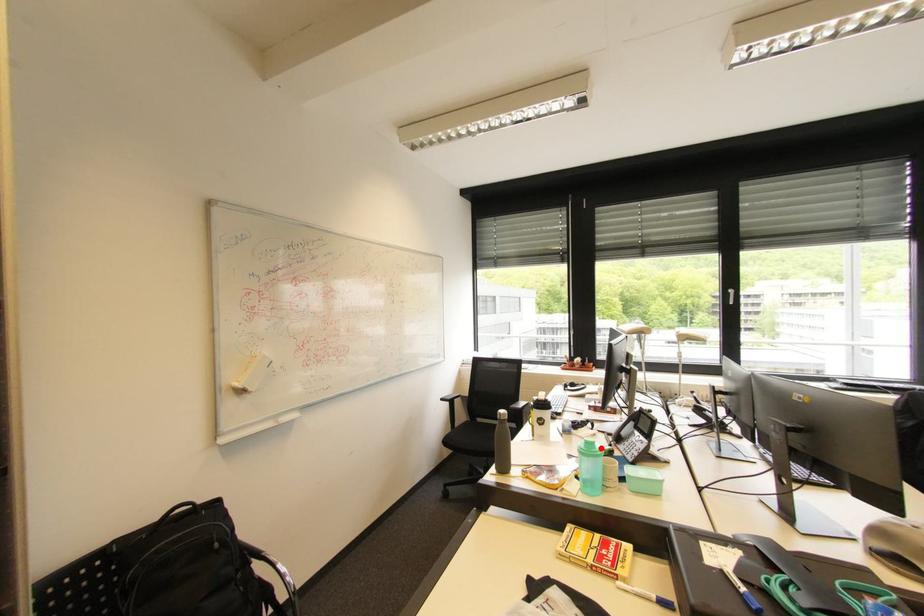
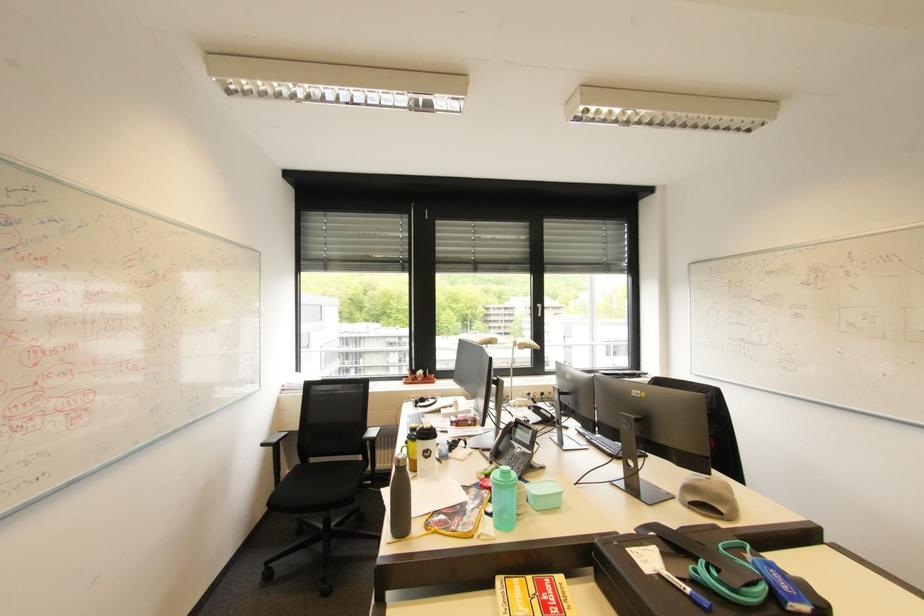
Locate, in the second image, the point that corresponds to the highlighted location in the first image.

(517, 477)